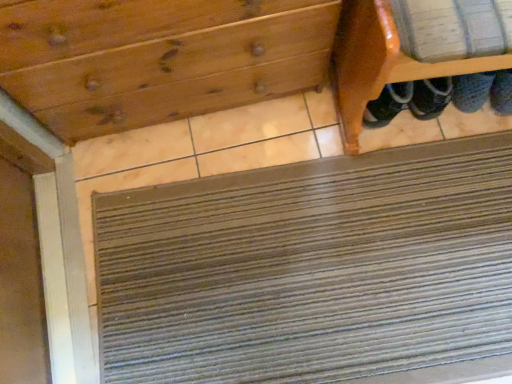
Question: From a real-world perspective, is wooden drawer at upper center above or below brown textured mat at lower center?

Choices:
 (A) below
 (B) above

Answer: (B)

Question: Is wooden drawer at upper center spatially inside brown textured mat at lower center, or outside of it?

Choices:
 (A) inside
 (B) outside

Answer: (B)

Question: Which is nearer to the wooden shoe rack at upper right?

Choices:
 (A) wooden drawer at upper center
 (B) brown textured mat at lower center

Answer: (A)

Question: Estimate the real-world distances between objects in this image. Which object is farther from the brown textured mat at lower center?

Choices:
 (A) wooden shoe rack at upper right
 (B) wooden drawer at upper center

Answer: (B)